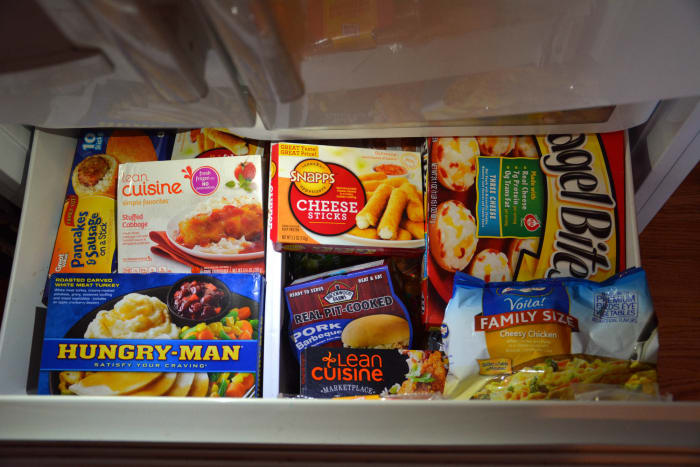
At what (x,y) coordinates should I click in order to perform the action: click on freezer drawer. Please return your answer as a coordinate pair (x, y). Image resolution: width=700 pixels, height=467 pixels. Looking at the image, I should click on (288, 419).